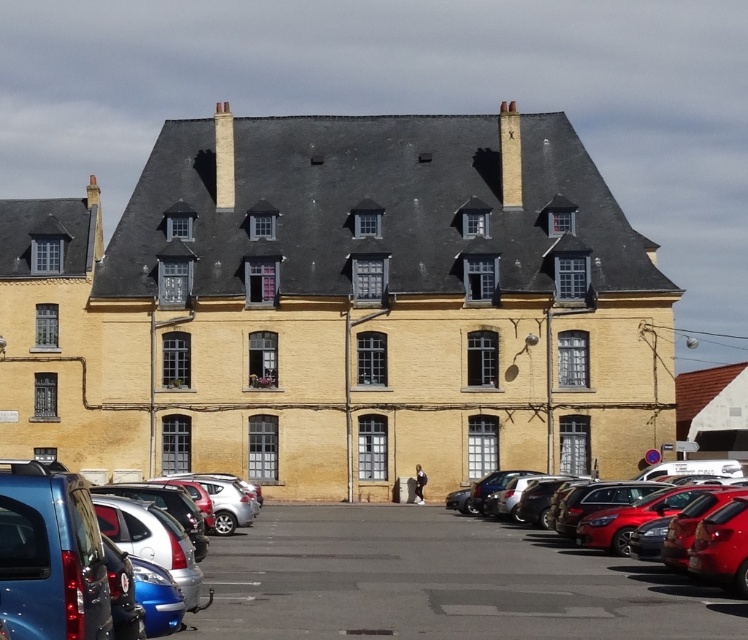
You are a visitor arriving at the building and see the metallic silver car at lower left and the shiny red car at lower right. Which car is parked closer to the entrance of the building?

The metallic silver car at lower left is located below the shiny red car at lower right, so it is closer to the entrance of the building.